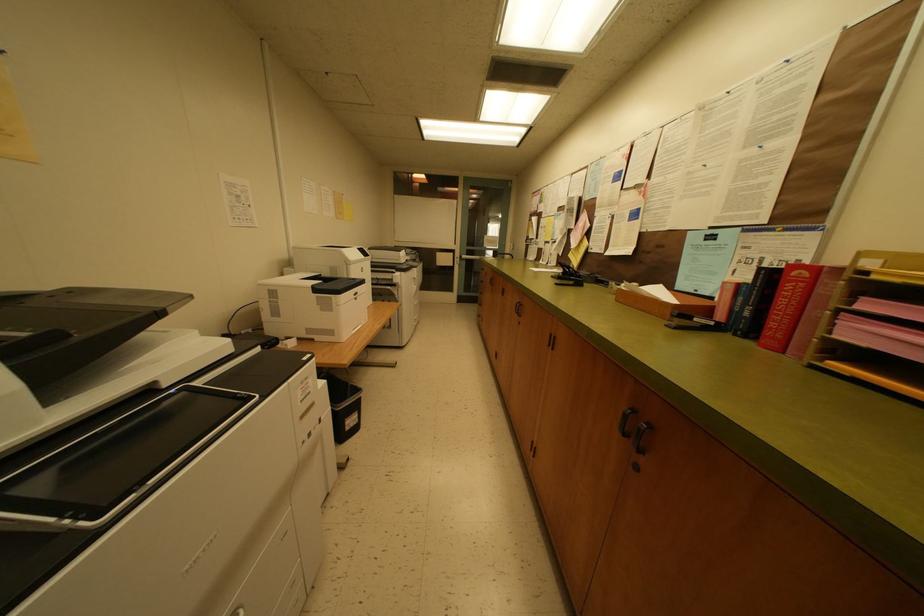
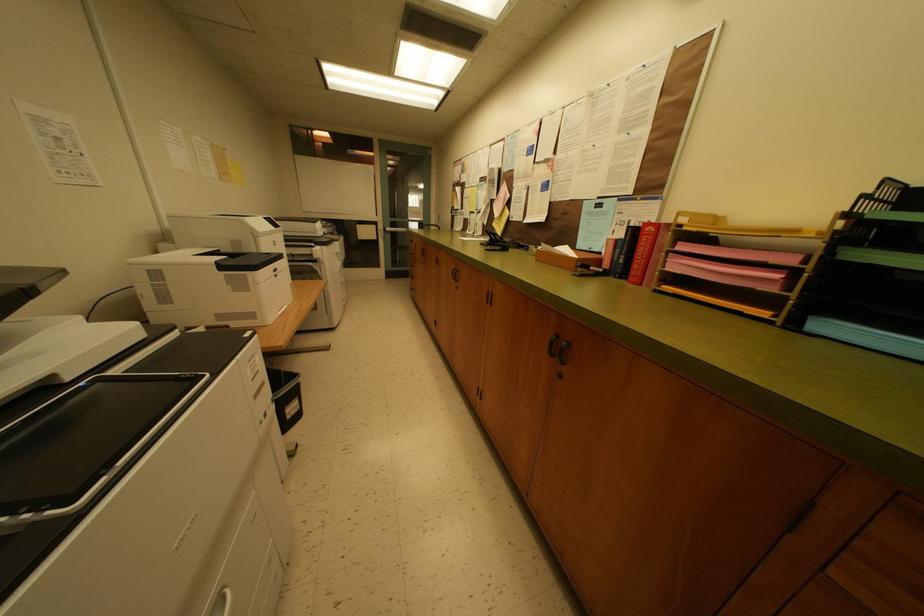
Question: The camera is either moving clockwise (left) or counter-clockwise (right) around the object. The first image is from the beginning of the video and the second image is from the end. Is the camera moving left or right when shooting the video?

Choices:
 (A) Left
 (B) Right

Answer: (A)